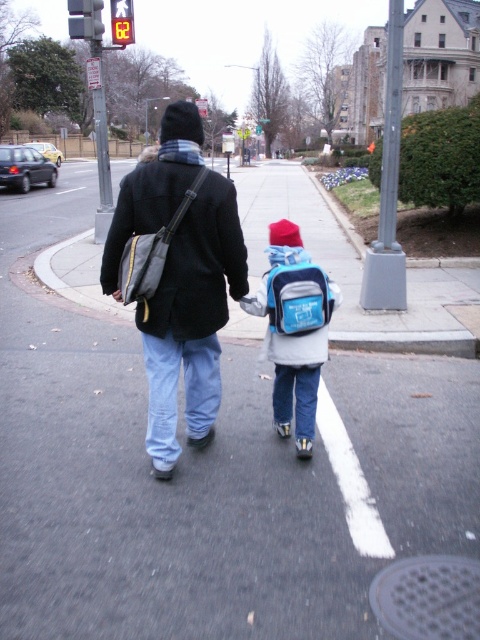
You are a delivery drone flying above the street. You need to deliver a package to the blue fabric backpack at center. The red plastic traffic light at upper left is in your flight path. Can you fly over the traffic light to reach the backpack without getting too close?

The blue fabric backpack at center and red plastic traffic light at upper left are 34.75 feet apart. Since the distance between them is sufficient, the drone can safely fly over the traffic light and reach the backpack without getting too close.

You are a pedestrian waiting at the crosswalk. You notice the dark matte jacket at upper left and the red plastic traffic light at upper left. Which object is wider from your perspective?

The dark matte jacket at upper left might be wider than red plastic traffic light at upper left according to the description.